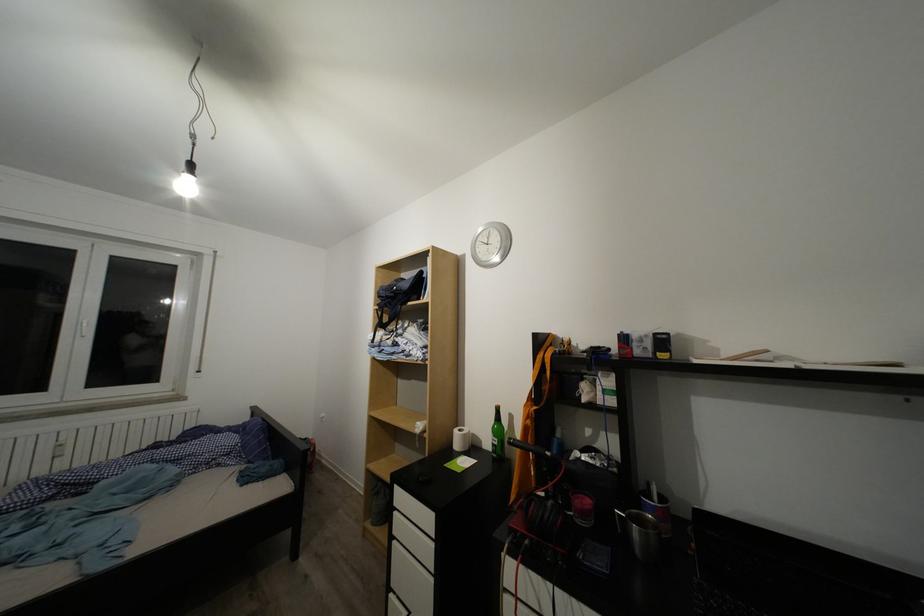
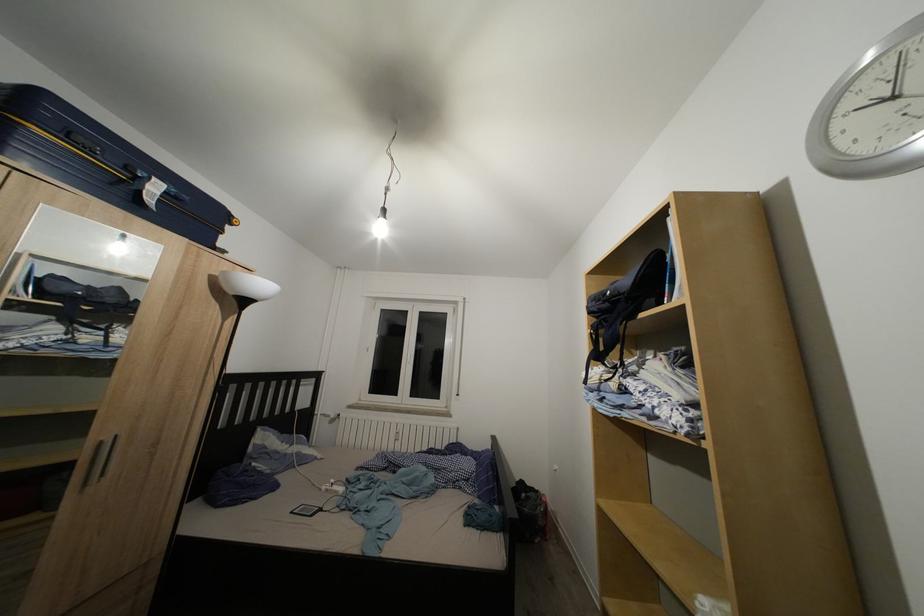
Question: The images are taken continuously from a first-person perspective. In which direction is your viewpoint rotating?

Choices:
 (A) Left
 (B) Right
 (C) Up
 (D) Down

Answer: (A)